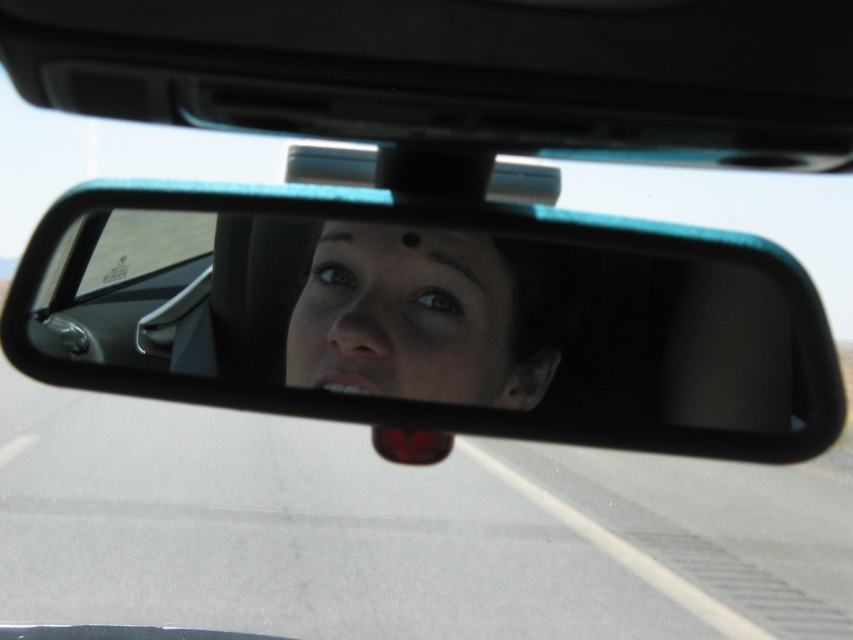
Question: Which of the following is the farthest from the observer?

Choices:
 (A) (338, 240)
 (B) (88, 289)

Answer: (B)

Question: Can you confirm if black plastic mirror at center is smaller than smooth skin face at center?

Choices:
 (A) no
 (B) yes

Answer: (A)

Question: Which object is farther from the camera taking this photo?

Choices:
 (A) black plastic mirror at center
 (B) smooth skin face at center

Answer: (B)

Question: From the image, what is the correct spatial relationship of black plastic mirror at center in relation to smooth skin face at center?

Choices:
 (A) above
 (B) below

Answer: (B)

Question: Can you confirm if black plastic mirror at center is positioned to the left of smooth skin face at center?

Choices:
 (A) yes
 (B) no

Answer: (A)